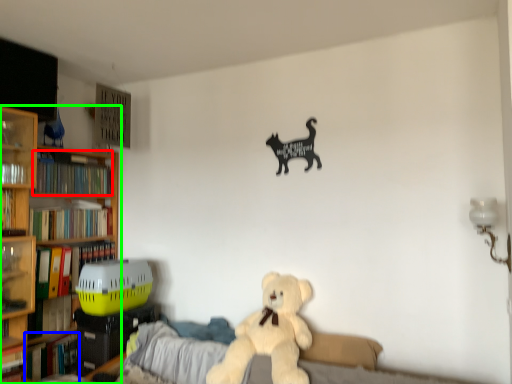
Question: Estimate the real-world distances between objects in this image. Which object is closer to book (highlighted by a red box), book (highlighted by a blue box) or bookcase (highlighted by a green box)?

Choices:
 (A) book
 (B) bookcase

Answer: (B)